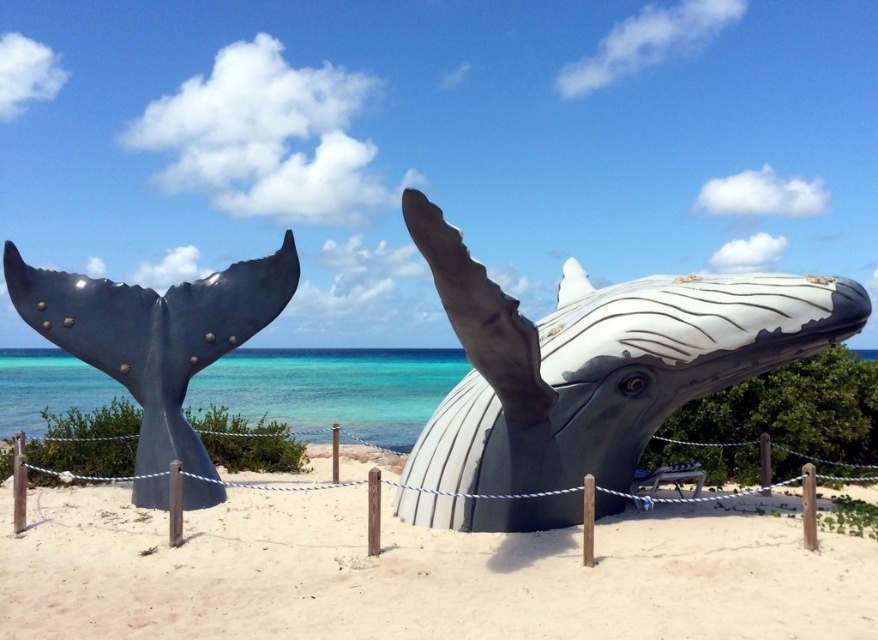
Consider the image. Is metallic gray whale at center below gray matte whale head at center?

Yes, metallic gray whale at center is below gray matte whale head at center.

Is point (34, 497) positioned before point (795, 333)?

That is False.

The width and height of the screenshot is (878, 640). Describe the element at coordinates (420, 572) in the screenshot. I see `metallic gray whale at center` at that location.

Where is `metallic gray whale at center`? The height and width of the screenshot is (640, 878). metallic gray whale at center is located at coordinates (420, 572).

Which of these two, metallic gray whale at center or clear blue water at whale right, stands shorter?

metallic gray whale at center

Which is more to the left, metallic gray whale at center or clear blue water at whale right?

clear blue water at whale right is more to the left.

Does point (844, 554) come in front of point (402, 436)?

Yes.

The width and height of the screenshot is (878, 640). I want to click on metallic gray whale at center, so click(x=420, y=572).

Is metallic gray whale at center positioned in front of metallic gray whale tail at left?

Yes, it is.

Is metallic gray whale at center thinner than metallic gray whale tail at left?

In fact, metallic gray whale at center might be wider than metallic gray whale tail at left.

Image resolution: width=878 pixels, height=640 pixels. Describe the element at coordinates (420, 572) in the screenshot. I see `metallic gray whale at center` at that location.

Identify the location of metallic gray whale at center. The height and width of the screenshot is (640, 878). (420, 572).